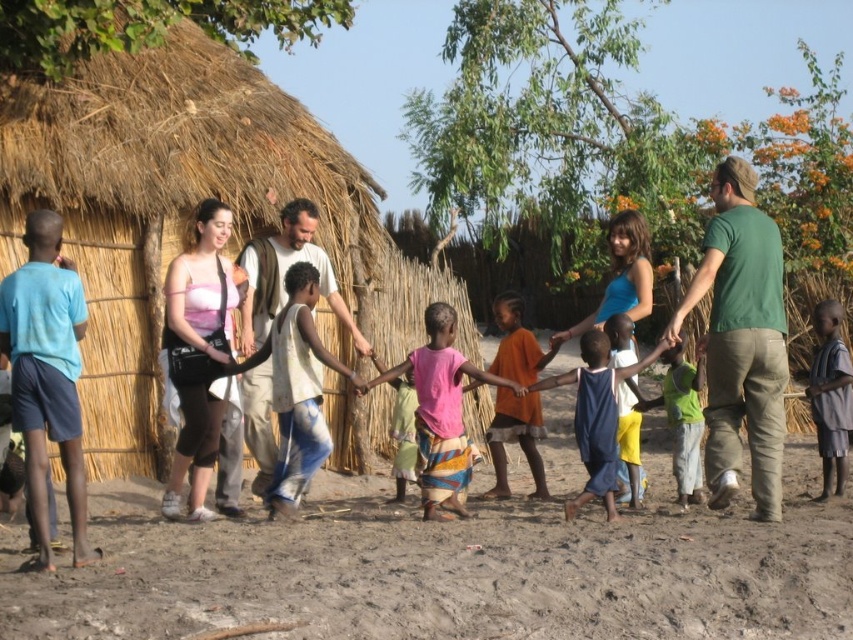
You are a photographer trying to capture the scene of the children playing near the thatched hut. You notice the pink fabric skirt at center and the light blue fabric at lower right. Which fabric is positioned lower in the image?

The pink fabric skirt at center is located below the light blue fabric at lower right, so the pink fabric skirt at center is positioned lower in the image.

Consider the image. You are a photographer standing in front of the thatched roof hut. You want to take a photo of the pink fabric skirt at center and the light blue fabric at lower right. Which object should you focus on first to ensure both are in the frame?

You should focus on the pink fabric skirt at center first since it is closer to the viewer, ensuring it is in focus before adjusting for the light blue fabric at lower right which is further away.

You are standing in the rural setting and see the image. There is a point marked at coordinates (440, 412). What object is located at that point?

The pink fabric skirt at center is located at point (440, 412).